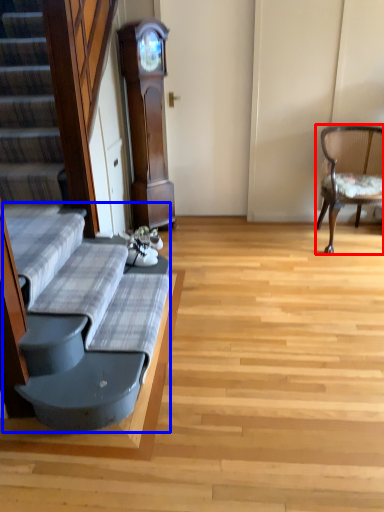
Question: Which of the following is the farthest to the observer, chair (highlighted by a red box) or couch (highlighted by a blue box)?

Choices:
 (A) chair
 (B) couch

Answer: (A)